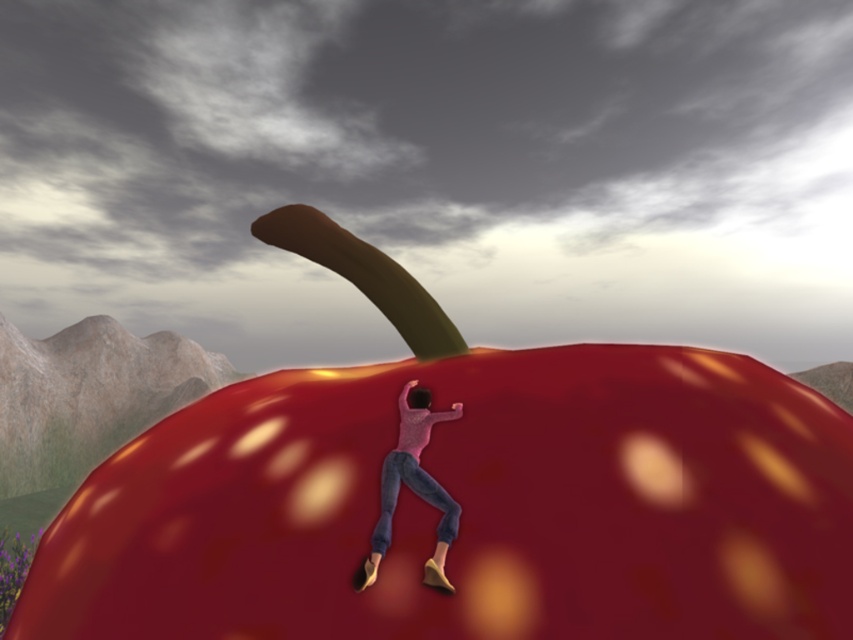
Question: Can you confirm if glossy red apple at center is wider than matte pink sweater at center?

Choices:
 (A) no
 (B) yes

Answer: (B)

Question: Does glossy red apple at center have a greater width compared to matte pink sweater at center?

Choices:
 (A) yes
 (B) no

Answer: (A)

Question: Where is glossy red apple at center located in relation to matte pink sweater at center in the image?

Choices:
 (A) left
 (B) right

Answer: (A)